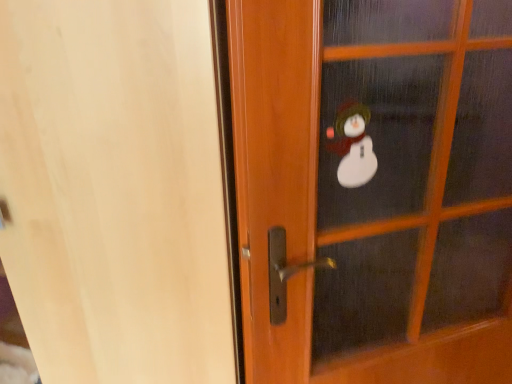
This screenshot has width=512, height=384. I want to click on wooden screen door at center, which ranks as the 1th screen door in right-to-left order, so click(416, 176).

Measure the distance between point (x=420, y=273) and camera.

A distance of 37.72 inches exists between point (x=420, y=273) and camera.

How much space does wooden screen door at center, marked as the second screen door in a left-to-right arrangement, occupy horizontally?

wooden screen door at center, marked as the second screen door in a left-to-right arrangement, is 2.82 inches wide.

What do you see at coordinates (416, 176) in the screenshot? I see `wooden screen door at center, which ranks as the 1th screen door in right-to-left order` at bounding box center [416, 176].

Based on the photo, measure the distance between wooden screen door at center, marked as the second screen door in a left-to-right arrangement, and camera.

The distance of wooden screen door at center, marked as the second screen door in a left-to-right arrangement, from camera is 26.23 inches.

Where is `transparent glass snowman at upper right, the first screen door from the left`? transparent glass snowman at upper right, the first screen door from the left is located at coordinates (120, 189).

Image resolution: width=512 pixels, height=384 pixels. Describe the element at coordinates (120, 189) in the screenshot. I see `transparent glass snowman at upper right, which is counted as the 2th screen door, starting from the right` at that location.

I want to click on wooden screen door at center, marked as the second screen door in a left-to-right arrangement, so click(416, 176).

Which object is positioned more to the right, transparent glass snowman at upper right, which is counted as the 2th screen door, starting from the right, or wooden screen door at center, which ranks as the 1th screen door in right-to-left order?

Positioned to the right is wooden screen door at center, which ranks as the 1th screen door in right-to-left order.

Considering the positions of objects transparent glass snowman at upper right, the first screen door from the left, and wooden screen door at center, which ranks as the 1th screen door in right-to-left order, in the image provided, who is in front, transparent glass snowman at upper right, the first screen door from the left, or wooden screen door at center, which ranks as the 1th screen door in right-to-left order,?

transparent glass snowman at upper right, the first screen door from the left, is more forward.

Does point (161, 194) come closer to viewer compared to point (402, 204)?

Yes, point (161, 194) is closer to viewer.

From the image's perspective, which is below, transparent glass snowman at upper right, the first screen door from the left, or wooden screen door at center, which ranks as the 1th screen door in right-to-left order?

transparent glass snowman at upper right, the first screen door from the left, appears lower in the image.

From a real-world perspective, is transparent glass snowman at upper right, the first screen door from the left, physically below wooden screen door at center, which ranks as the 1th screen door in right-to-left order?

Yes.

Which object is thinner, transparent glass snowman at upper right, the first screen door from the left, or wooden screen door at center, which ranks as the 1th screen door in right-to-left order?

wooden screen door at center, which ranks as the 1th screen door in right-to-left order, is thinner.

Is transparent glass snowman at upper right, which is counted as the 2th screen door, starting from the right, taller or shorter than wooden screen door at center, which ranks as the 1th screen door in right-to-left order?

In the image, transparent glass snowman at upper right, which is counted as the 2th screen door, starting from the right, appears to be taller than wooden screen door at center, which ranks as the 1th screen door in right-to-left order.

Is transparent glass snowman at upper right, which is counted as the 2th screen door, starting from the right, bigger or smaller than wooden screen door at center, which ranks as the 1th screen door in right-to-left order?

Clearly, transparent glass snowman at upper right, which is counted as the 2th screen door, starting from the right, is larger in size than wooden screen door at center, which ranks as the 1th screen door in right-to-left order.

Which is correct: transparent glass snowman at upper right, which is counted as the 2th screen door, starting from the right, is inside wooden screen door at center, which ranks as the 1th screen door in right-to-left order, or outside of it?

transparent glass snowman at upper right, which is counted as the 2th screen door, starting from the right, is located beyond the bounds of wooden screen door at center, which ranks as the 1th screen door in right-to-left order.

Is transparent glass snowman at upper right, the first screen door from the left, touching wooden screen door at center, which ranks as the 1th screen door in right-to-left order?

transparent glass snowman at upper right, the first screen door from the left, and wooden screen door at center, which ranks as the 1th screen door in right-to-left order, are clearly separated.

Is transparent glass snowman at upper right, the first screen door from the left, oriented towards wooden screen door at center, marked as the second screen door in a left-to-right arrangement?

No, transparent glass snowman at upper right, the first screen door from the left, is not oriented towards wooden screen door at center, marked as the second screen door in a left-to-right arrangement.

The width and height of the screenshot is (512, 384). What are the coordinates of `screen door in front of the wooden screen door at center, marked as the second screen door in a left-to-right arrangement` in the screenshot? It's located at (120, 189).

Between wooden screen door at center, marked as the second screen door in a left-to-right arrangement, and transparent glass snowman at upper right, the first screen door from the left, which one appears on the right side from the viewer's perspective?

From the viewer's perspective, wooden screen door at center, marked as the second screen door in a left-to-right arrangement, appears more on the right side.

Considering the relative positions of wooden screen door at center, marked as the second screen door in a left-to-right arrangement, and transparent glass snowman at upper right, the first screen door from the left, in the image provided, is wooden screen door at center, marked as the second screen door in a left-to-right arrangement, behind transparent glass snowman at upper right, the first screen door from the left,?

Yes, wooden screen door at center, marked as the second screen door in a left-to-right arrangement, is further from the camera.

Which is in front, point (351, 308) or point (200, 162)?

The point (200, 162) is closer to the camera.

From the image's perspective, is wooden screen door at center, which ranks as the 1th screen door in right-to-left order, positioned above or below transparent glass snowman at upper right, which is counted as the 2th screen door, starting from the right?

wooden screen door at center, which ranks as the 1th screen door in right-to-left order, is above transparent glass snowman at upper right, which is counted as the 2th screen door, starting from the right.

From a real-world perspective, between wooden screen door at center, marked as the second screen door in a left-to-right arrangement, and transparent glass snowman at upper right, the first screen door from the left, who is vertically higher?

In real-world perspective, wooden screen door at center, marked as the second screen door in a left-to-right arrangement, is above.

Which object is thinner, wooden screen door at center, marked as the second screen door in a left-to-right arrangement, or transparent glass snowman at upper right, which is counted as the 2th screen door, starting from the right?

wooden screen door at center, marked as the second screen door in a left-to-right arrangement.

Does wooden screen door at center, which ranks as the 1th screen door in right-to-left order, have a lesser height compared to transparent glass snowman at upper right, the first screen door from the left?

Correct, wooden screen door at center, which ranks as the 1th screen door in right-to-left order, is not as tall as transparent glass snowman at upper right, the first screen door from the left.

Between wooden screen door at center, marked as the second screen door in a left-to-right arrangement, and transparent glass snowman at upper right, the first screen door from the left, which one has larger size?

With larger size is transparent glass snowman at upper right, the first screen door from the left.

Is wooden screen door at center, which ranks as the 1th screen door in right-to-left order, not inside transparent glass snowman at upper right, which is counted as the 2th screen door, starting from the right?

That's correct, wooden screen door at center, which ranks as the 1th screen door in right-to-left order, is outside of transparent glass snowman at upper right, which is counted as the 2th screen door, starting from the right.

Is wooden screen door at center, which ranks as the 1th screen door in right-to-left order, with transparent glass snowman at upper right, the first screen door from the left?

No, wooden screen door at center, which ranks as the 1th screen door in right-to-left order, is not with transparent glass snowman at upper right, the first screen door from the left.

Is wooden screen door at center, which ranks as the 1th screen door in right-to-left order, aimed at transparent glass snowman at upper right, which is counted as the 2th screen door, starting from the right?

No, wooden screen door at center, which ranks as the 1th screen door in right-to-left order, is not aimed at transparent glass snowman at upper right, which is counted as the 2th screen door, starting from the right.

How many degrees apart are the facing directions of wooden screen door at center, which ranks as the 1th screen door in right-to-left order, and transparent glass snowman at upper right, which is counted as the 2th screen door, starting from the right?

32.1 degrees.

At what (x,y) coordinates should I click in order to perform the action: click on screen door above the transparent glass snowman at upper right, the first screen door from the left (from the image's perspective). Please return your answer as a coordinate pair (x, y). Looking at the image, I should click on (416, 176).

Where is `screen door below the wooden screen door at center, which ranks as the 1th screen door in right-to-left order (from the image's perspective)`? The height and width of the screenshot is (384, 512). screen door below the wooden screen door at center, which ranks as the 1th screen door in right-to-left order (from the image's perspective) is located at coordinates (120, 189).

At what (x,y) coordinates should I click in order to perform the action: click on screen door to the right of transparent glass snowman at upper right, the first screen door from the left. Please return your answer as a coordinate pair (x, y). The height and width of the screenshot is (384, 512). Looking at the image, I should click on (416, 176).